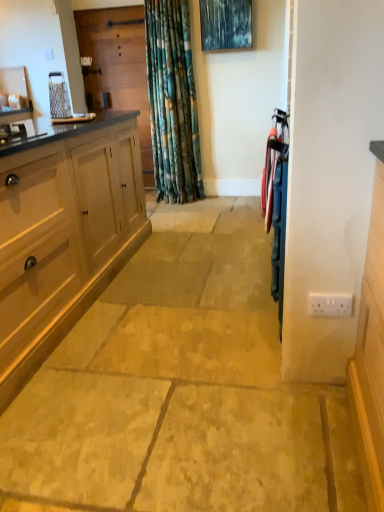
Where is `wooden screen door at upper left, which ranks as the 1th screen door in left-to-right order`? wooden screen door at upper left, which ranks as the 1th screen door in left-to-right order is located at coordinates (117, 68).

You are a GUI agent. You are given a task and a screenshot of the screen. Output one action in this format:
    pyautogui.click(x=<x>, y=<y>)
    Task: Click on the white plastic electric outlet at lower right
    
    Given the screenshot: What is the action you would take?
    pyautogui.click(x=330, y=304)

At what (x,y) coordinates should I click in order to perform the action: click on metallic blue screen door at right, the 2th screen door from the left. Please return your answer as a coordinate pair (x, y). This screenshot has height=512, width=384. Looking at the image, I should click on (330, 175).

Measure the distance between point (299, 138) and camera.

The distance of point (299, 138) from camera is 4.39 feet.

Image resolution: width=384 pixels, height=512 pixels. What are the coordinates of `metallic blue painting at upper center` in the screenshot? It's located at (226, 24).

Where is `wooden screen door at upper left, which is the 1th screen door in back-to-front order`? This screenshot has width=384, height=512. wooden screen door at upper left, which is the 1th screen door in back-to-front order is located at coordinates (117, 68).

Between wooden screen door at upper left, which is the 1th screen door in back-to-front order, and metallic blue screen door at right, which ranks as the first screen door in bottom-to-top order, which one has smaller size?

Smaller between the two is metallic blue screen door at right, which ranks as the first screen door in bottom-to-top order.

Is wooden screen door at upper left, marked as the second screen door in a bottom-to-top arrangement, far away from metallic blue screen door at right, which ranks as the first screen door in bottom-to-top order?

Yes.

Is wooden screen door at upper left, the second screen door from the right, oriented towards metallic blue screen door at right, marked as the second screen door in a back-to-front arrangement?

No, wooden screen door at upper left, the second screen door from the right, is not oriented towards metallic blue screen door at right, marked as the second screen door in a back-to-front arrangement.

Is white plastic electric outlet at lower right to the left or to the right of wooden screen door at upper left, marked as the second screen door in a bottom-to-top arrangement, in the image?

Clearly, white plastic electric outlet at lower right is on the right of wooden screen door at upper left, marked as the second screen door in a bottom-to-top arrangement, in the image.

Looking at this image, from their relative heights in the image, would you say white plastic electric outlet at lower right is taller or shorter than wooden screen door at upper left, arranged as the 1th screen door when viewed from the top?

white plastic electric outlet at lower right is shorter than wooden screen door at upper left, arranged as the 1th screen door when viewed from the top.

From the image's perspective, is white plastic electric outlet at lower right above or below wooden screen door at upper left, which is the second screen door in front-to-back order?

From the image's perspective, white plastic electric outlet at lower right appears below wooden screen door at upper left, which is the second screen door in front-to-back order.

Which object is positioned more to the left, metallic blue screen door at right, placed as the first screen door when sorted from right to left, or wooden screen door at upper left, which is the second screen door in front-to-back order?

wooden screen door at upper left, which is the second screen door in front-to-back order.

Is wooden screen door at upper left, which is the 1th screen door in back-to-front order, inside metallic blue screen door at right, which ranks as the first screen door in bottom-to-top order?

That's incorrect, wooden screen door at upper left, which is the 1th screen door in back-to-front order, is not inside metallic blue screen door at right, which ranks as the first screen door in bottom-to-top order.

Is there a large distance between metallic blue screen door at right, the 1th screen door from the front, and wooden screen door at upper left, marked as the second screen door in a bottom-to-top arrangement?

Yes, metallic blue screen door at right, the 1th screen door from the front, and wooden screen door at upper left, marked as the second screen door in a bottom-to-top arrangement, are quite far apart.

How far apart are metallic blue screen door at right, which ranks as the first screen door in bottom-to-top order, and wooden screen door at upper left, the second screen door from the right?

11.14 feet.

Considering the relative sizes of metallic blue screen door at right, which ranks as the first screen door in bottom-to-top order, and metallic blue painting at upper center in the image provided, is metallic blue screen door at right, which ranks as the first screen door in bottom-to-top order, shorter than metallic blue painting at upper center?

Incorrect, the height of metallic blue screen door at right, which ranks as the first screen door in bottom-to-top order, does not fall short of that of metallic blue painting at upper center.

From a real-world perspective, relative to metallic blue painting at upper center, is metallic blue screen door at right, the 2th screen door from the left, vertically above or below?

Clearly, from a real-world perspective, metallic blue screen door at right, the 2th screen door from the left, is below metallic blue painting at upper center.

Based on the photo, can you confirm if metallic blue screen door at right, acting as the 2th screen door starting from the top, is thinner than metallic blue painting at upper center?

Correct, the width of metallic blue screen door at right, acting as the 2th screen door starting from the top, is less than that of metallic blue painting at upper center.

Is metallic blue screen door at right, the 1th screen door from the front, bigger than metallic blue painting at upper center?

Yes, metallic blue screen door at right, the 1th screen door from the front, is bigger than metallic blue painting at upper center.

Which object is positioned more to the right, metallic blue screen door at right, the 1th screen door from the front, or white plastic electric outlet at lower right?

white plastic electric outlet at lower right is more to the right.

Which object is thinner, metallic blue screen door at right, the 2th screen door from the left, or white plastic electric outlet at lower right?

white plastic electric outlet at lower right.

Which is in front, point (358, 128) or point (338, 300)?

The point (358, 128) is closer to the camera.

Is metallic blue screen door at right, which ranks as the first screen door in bottom-to-top order, located outside white plastic electric outlet at lower right?

metallic blue screen door at right, which ranks as the first screen door in bottom-to-top order, lies outside white plastic electric outlet at lower right's area.

Which is nearer, (x=217, y=22) or (x=314, y=315)?

Point (x=217, y=22) is farther from the camera than point (x=314, y=315).

Which object is more forward, metallic blue painting at upper center or white plastic electric outlet at lower right?

Positioned in front is white plastic electric outlet at lower right.

From the image's perspective, which object appears higher, metallic blue painting at upper center or white plastic electric outlet at lower right?

metallic blue painting at upper center.

Considering the positions of objects metallic blue painting at upper center and wooden screen door at upper left, which is the second screen door in front-to-back order, in the image provided, who is more to the right, metallic blue painting at upper center or wooden screen door at upper left, which is the second screen door in front-to-back order,?

From the viewer's perspective, metallic blue painting at upper center appears more on the right side.

Considering the sizes of objects metallic blue painting at upper center and wooden screen door at upper left, which is the 1th screen door in back-to-front order, in the image provided, who is shorter, metallic blue painting at upper center or wooden screen door at upper left, which is the 1th screen door in back-to-front order,?

With less height is metallic blue painting at upper center.

Looking at the image, does metallic blue painting at upper center seem bigger or smaller compared to wooden screen door at upper left, which ranks as the 1th screen door in left-to-right order?

Considering their sizes, metallic blue painting at upper center takes up less space than wooden screen door at upper left, which ranks as the 1th screen door in left-to-right order.

Where is `screen door on the right of the wooden screen door at upper left, the second screen door from the right`? The height and width of the screenshot is (512, 384). screen door on the right of the wooden screen door at upper left, the second screen door from the right is located at coordinates click(330, 175).

From the image's perspective, starting from the white plastic electric outlet at lower right, which screen door is the 2nd one above? Please provide its 2D coordinates.

[(117, 68)]

Looking at the image, which one is located further to metallic blue painting at upper center, metallic blue screen door at right, acting as the 2th screen door starting from the top, or white plastic electric outlet at lower right?

white plastic electric outlet at lower right lies further to metallic blue painting at upper center than the other object.

Estimate the real-world distances between objects in this image. Which object is closer to metallic blue painting at upper center, metallic blue screen door at right, the 2th screen door from the left, or wooden screen door at upper left, which is the 1th screen door in back-to-front order?

wooden screen door at upper left, which is the 1th screen door in back-to-front order, is closer to metallic blue painting at upper center.

Considering their positions, is white plastic electric outlet at lower right positioned further to metallic blue painting at upper center than wooden screen door at upper left, marked as the second screen door in a bottom-to-top arrangement?

Among the two, white plastic electric outlet at lower right is located further to metallic blue painting at upper center.

Estimate the real-world distances between objects in this image. Which object is further from white plastic electric outlet at lower right, metallic blue screen door at right, acting as the 2th screen door starting from the top, or metallic blue painting at upper center?

metallic blue painting at upper center lies further to white plastic electric outlet at lower right than the other object.

Based on their spatial positions, is metallic blue painting at upper center or wooden screen door at upper left, which ranks as the 1th screen door in left-to-right order, closer to metallic blue screen door at right, marked as the second screen door in a back-to-front arrangement?

metallic blue painting at upper center lies closer to metallic blue screen door at right, marked as the second screen door in a back-to-front arrangement, than the other object.

Based on their spatial positions, is white plastic electric outlet at lower right or wooden screen door at upper left, which is the second screen door in front-to-back order, further from metallic blue screen door at right, the 1th screen door from the front?

Based on the image, wooden screen door at upper left, which is the second screen door in front-to-back order, appears to be further to metallic blue screen door at right, the 1th screen door from the front.

Which object lies nearer to the anchor point wooden screen door at upper left, the second screen door from the right, metallic blue screen door at right, the 2th screen door from the left, or metallic blue painting at upper center?

Based on the image, metallic blue painting at upper center appears to be nearer to wooden screen door at upper left, the second screen door from the right.

Looking at the image, which one is located further to metallic blue painting at upper center, wooden screen door at upper left, the second screen door from the right, or metallic blue screen door at right, placed as the first screen door when sorted from right to left?

metallic blue screen door at right, placed as the first screen door when sorted from right to left.

I want to click on electric outlet between metallic blue screen door at right, placed as the first screen door when sorted from right to left, and wooden screen door at upper left, which ranks as the 1th screen door in left-to-right order, along the z-axis, so pyautogui.click(x=330, y=304).

Identify the location of picture frame located between metallic blue screen door at right, placed as the first screen door when sorted from right to left, and wooden screen door at upper left, the second screen door from the right, in the depth direction. This screenshot has height=512, width=384. (226, 24).

Find the location of a particular element. picture frame located between white plastic electric outlet at lower right and wooden screen door at upper left, the second screen door from the right, in the depth direction is located at coordinates (226, 24).

Locate an element on the screen. This screenshot has width=384, height=512. electric outlet located between metallic blue screen door at right, the 1th screen door from the front, and metallic blue painting at upper center in the depth direction is located at coordinates (330, 304).